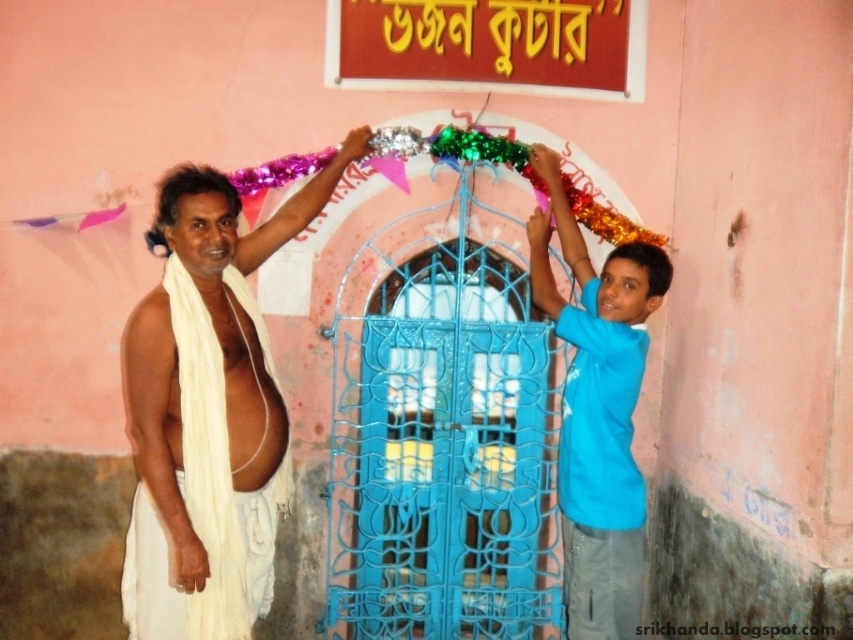
Consider the image. You are standing in front of the doorway and want to hang a decoration. There are two points marked on the wall where you can attach the decoration. The points are labeled as point 1 at coordinates point (569,497) and point 2 at coordinates point (263,488). Which point is closer to you?

Point 1 at coordinates point (569,497) is closer to you because it is further to the camera than point 2 at coordinates point (263,488).